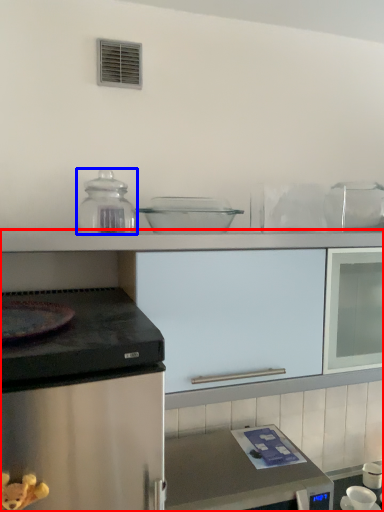
Question: Among these objects, which one is farthest to the camera, cabinetry (highlighted by a red box) or kitchen appliance (highlighted by a blue box)?

Choices:
 (A) cabinetry
 (B) kitchen appliance

Answer: (B)